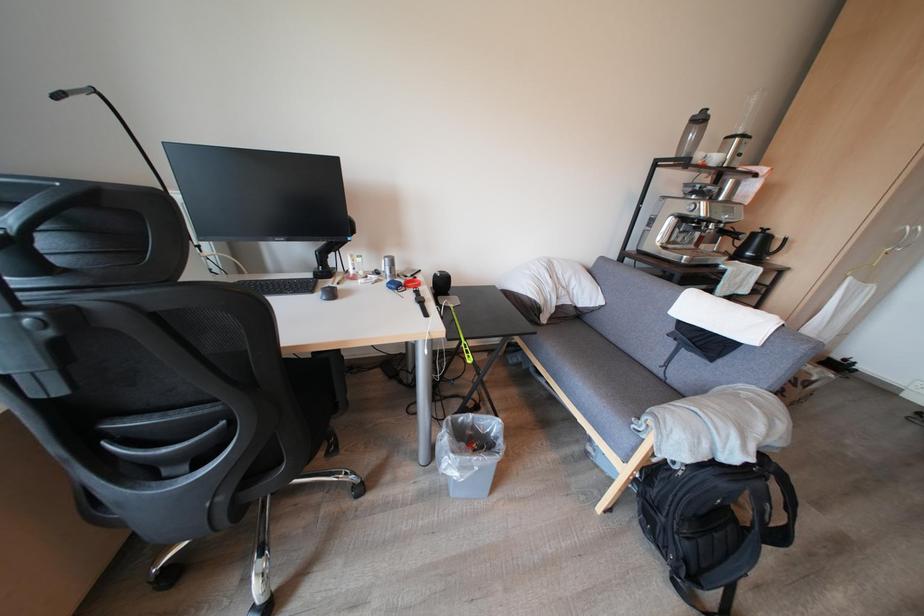
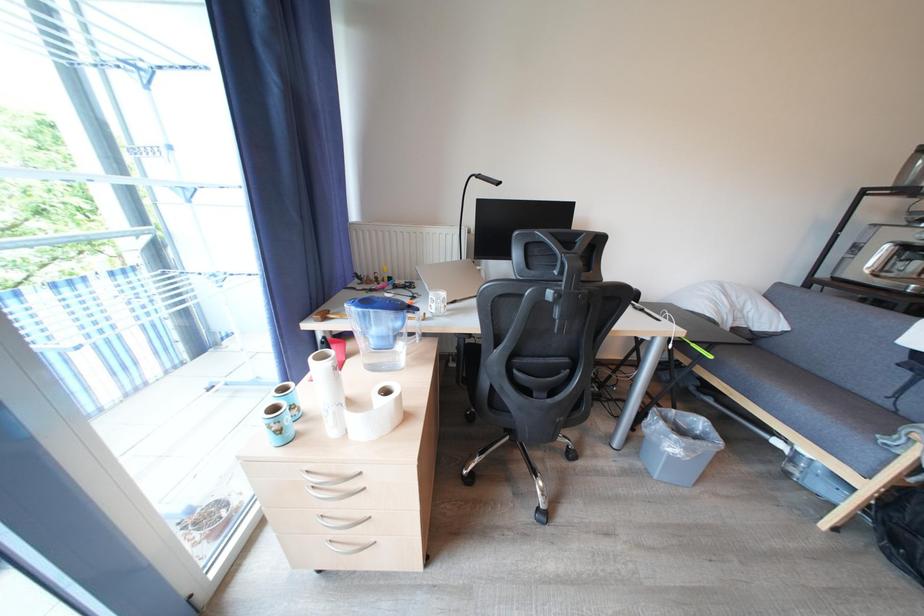
The images are taken continuously from a first-person perspective. In which direction are you moving?

The cameraman walked toward left, backward.